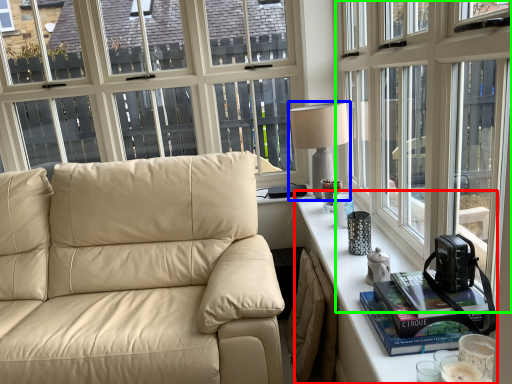
Question: Based on their relative distances, which object is farther from table (highlighted by a red box)? Choose from table lamp (highlighted by a blue box) and window (highlighted by a green box).

Choices:
 (A) table lamp
 (B) window

Answer: (A)